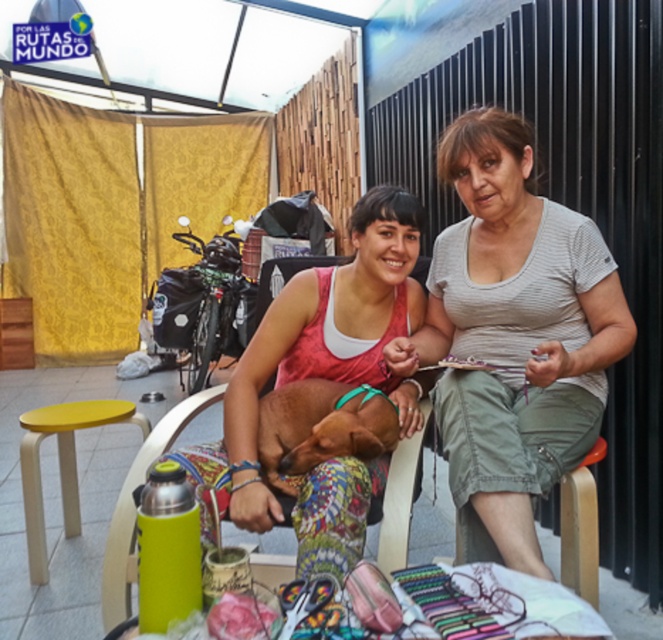
You are organizing a picnic and need to place the gray striped shirt at center and the yellow matte stool at lower left. Based on their positions, which object is higher up?

The gray striped shirt at center is located above the yellow matte stool at lower left, so the gray striped shirt at center is higher up.